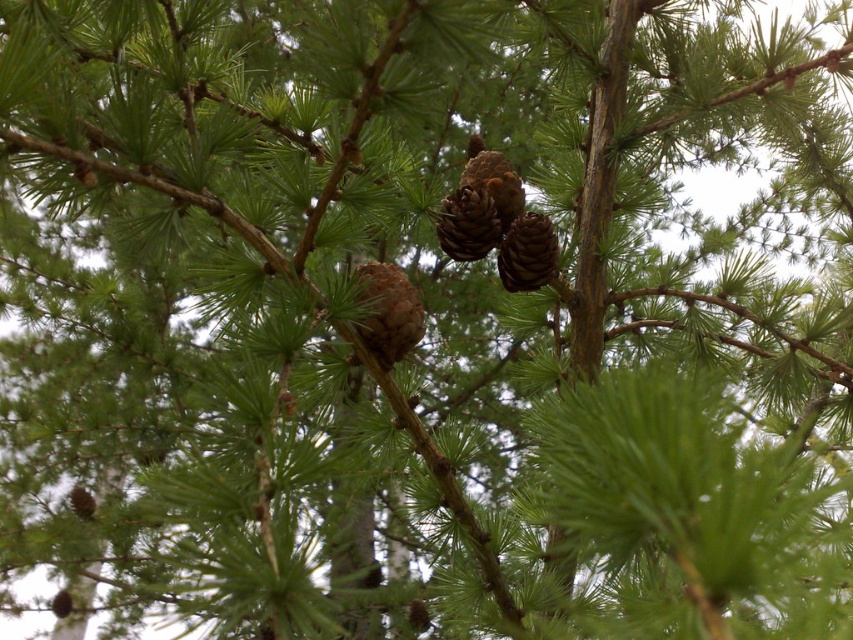
In the scene shown: You are a botanist examining two pine cones on a larch tree. You have the brown matte pine cone at center and the brown rough pine cone at center in your collection. Which of these two pine cones has a greater width?

The brown rough pine cone at center has a greater width than the brown matte pine cone at center.

You are a bird looking for a place to perch on the branches of the coniferous tree. You notice two pine cones at the center of the image. Which pine cone is located lower between the brown matte pine cone at center and the brown rough pine cone at center?

The brown matte pine cone at center is positioned under the brown rough pine cone at center, so it is lower.